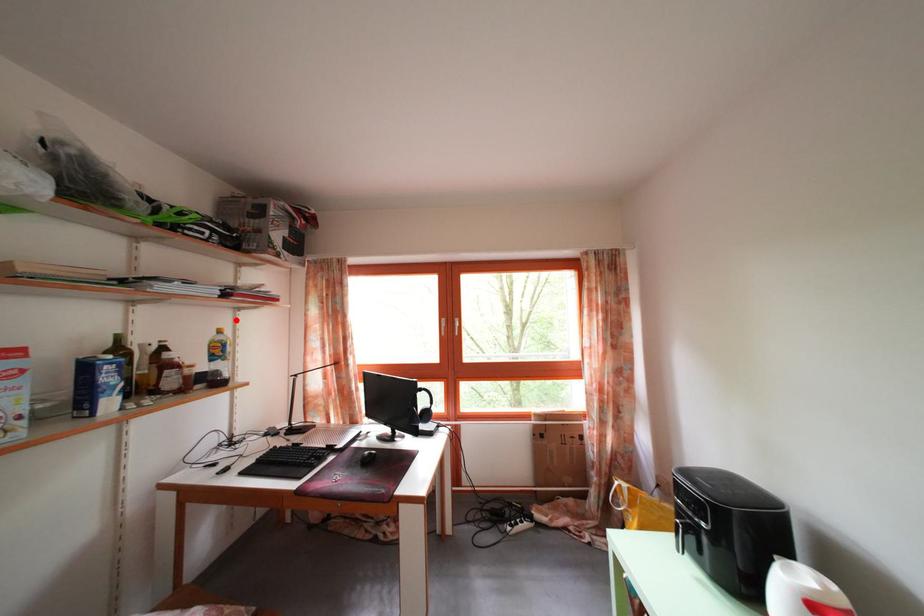
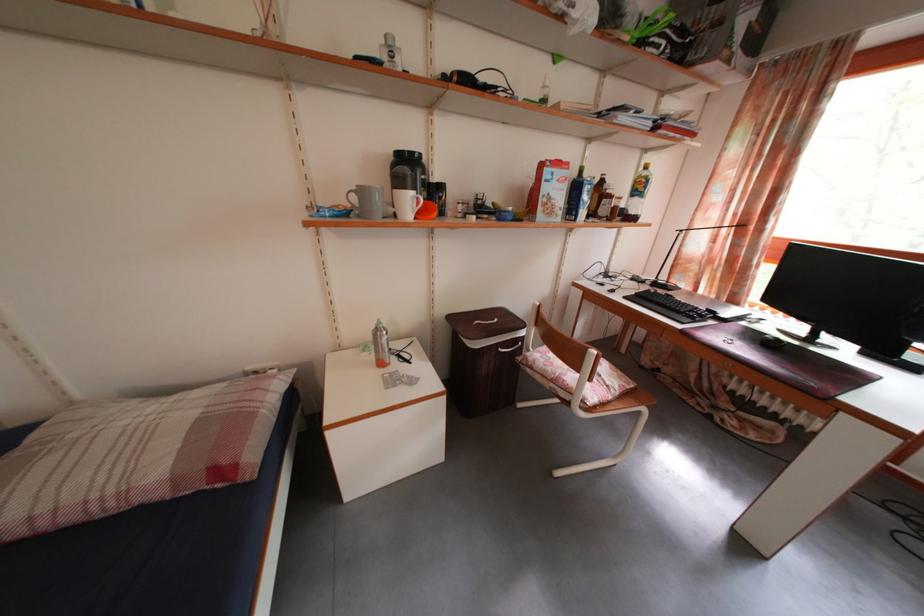
The point at the highlighted location is marked in the first image. Where is the corresponding point in the second image?

(643, 161)